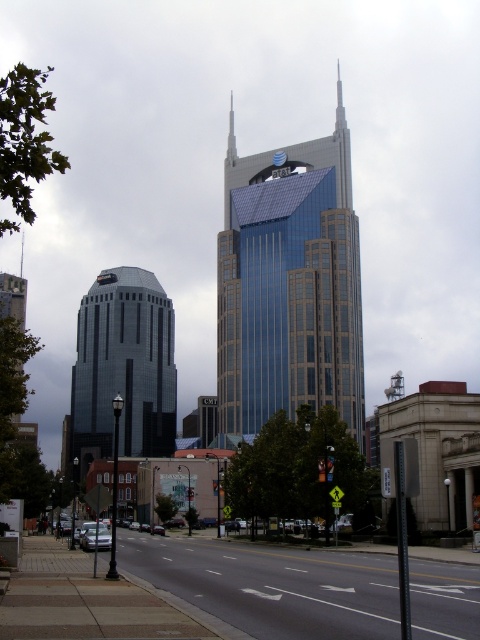
You are standing at the point with coordinates point [300,156] and want to walk to point [104,420]. Given that the street has multiple lanes and sidewalks with trees, will you have to walk towards the direction of the curved glass building or away from it?

Since point [300,156] is in front of point [104,420], you would need to walk away from the curved glass building to reach your destination.

You are a drone operator tasked with flying a drone between the smooth silver spire at upper center and the metallic silver spire at center. The drone has a maximum flight distance of 200 meters. Can the drone safely complete this flight without needing to recharge?

The distance between the smooth silver spire at upper center and the metallic silver spire at center is 216.63 meters, which exceeds the drone operator stated maximum flight distance of 200 meters. Therefore, the drone cannot safely complete the flight without needing to recharge.

You are a drone operator who needs to deliver a package to the top of the smooth silver spire at upper center. Your drone has a maximum flight altitude of 300 meters. According to the image, can your drone reach the point at coordinates point [230,136]?

The point [230,136] is on smooth silver spire at upper center. Since the spire is part of the building and the drone can fly up to 300 meters, it should be able to reach the point unless there are obstructions. However, the image does not provide specific altitude details, so we can only confirm the location based on coordinates.